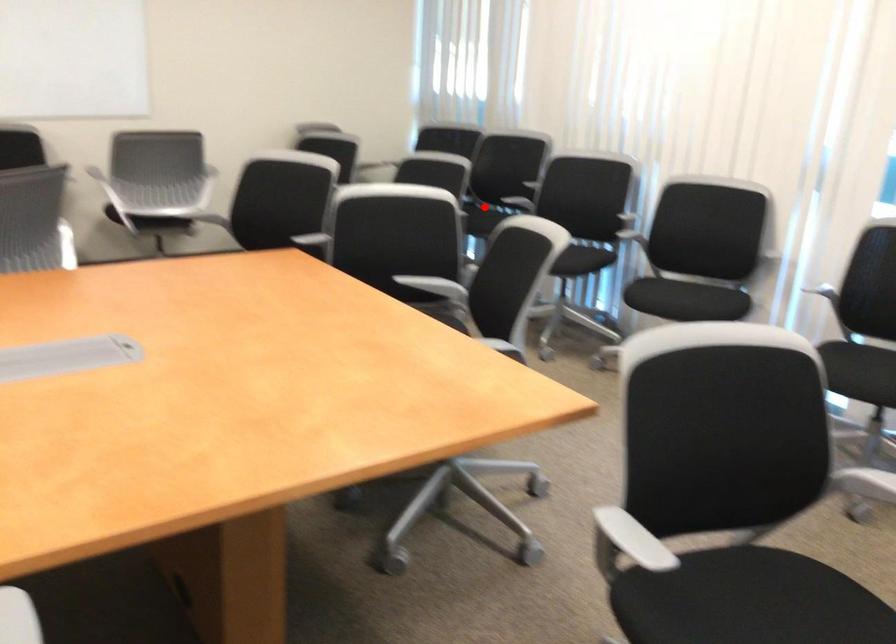
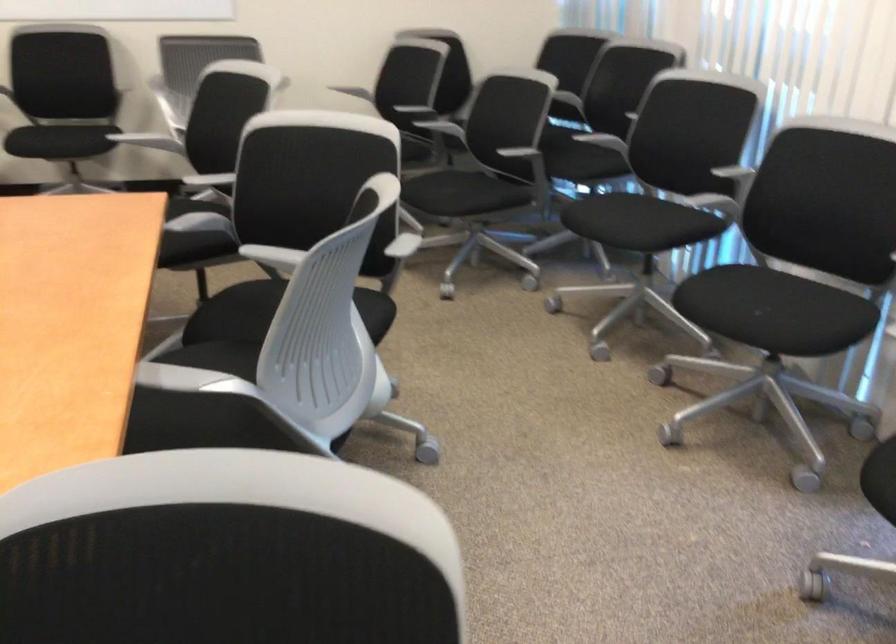
Question: I am providing you with two images of the same scene from different viewpoints. In image1, a red point is highlighted. Considering the same 3D point in image2, which of the following is correct?

Choices:
 (A) It is closer
 (B) It is farther

Answer: (A)